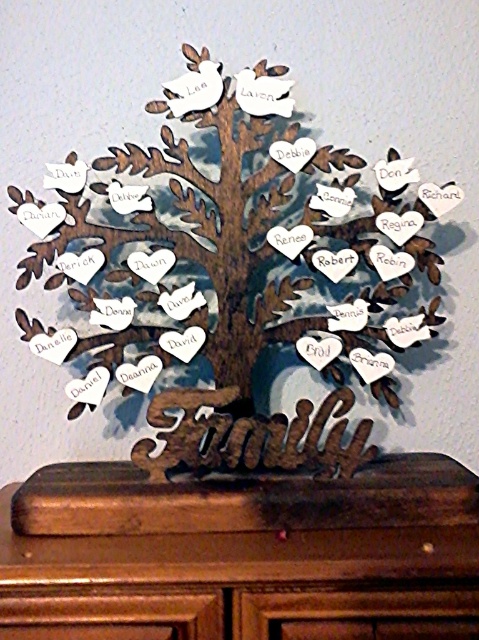
In the scene shown: You are an art installer setting up a new family tree display. You need to place two decorative lights at the coordinates point (193, 172) and point (353, 547). According to the scene, which light will be closer to the viewer?

Point (353, 547) will be closer to the viewer because point (193, 172) is behind it.

Consider the image. You are an interior designer planning to place a new painting that is 1.2 meters wide between the wooden family tree at center and the brown wood dresser at lower center. Can the space between them accommodate the painting?

The wooden family tree at center is narrower than the brown wood dresser at lower center. However, the exact distance between them isn not provided in the description, so we cannot determine if the 1.2 meter wide painting will fit without additional information about the spacing between the two objects.

You are standing in front of a wall with a decorative wooden family tree. The family tree is located at a specific coordinate. What are the coordinates of the wooden family tree at center?

The wooden family tree at center is located at point (x=235, y=280).